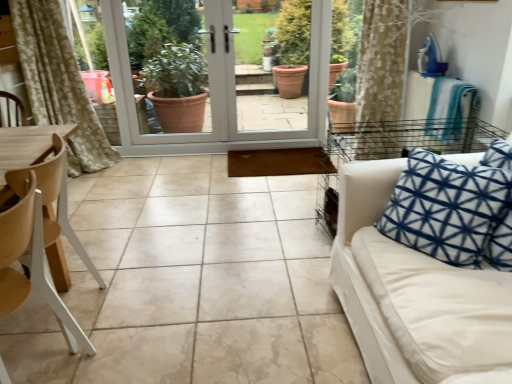
Question: Is wooden at left, the 2th chair in the front-to-back sequence, smaller than white fabric couch at right?

Choices:
 (A) no
 (B) yes

Answer: (B)

Question: From a real-world perspective, is wooden at left, the 2th chair in the front-to-back sequence, on white fabric couch at right?

Choices:
 (A) yes
 (B) no

Answer: (B)

Question: Is wooden at left, the 2th chair in the front-to-back sequence, beside white fabric couch at right?

Choices:
 (A) yes
 (B) no

Answer: (B)

Question: Is wooden at left, the 2th chair in the front-to-back sequence, thinner than white fabric couch at right?

Choices:
 (A) yes
 (B) no

Answer: (A)

Question: Can you confirm if wooden at left, the 2th chair in the front-to-back sequence, is positioned to the right of white fabric couch at right?

Choices:
 (A) yes
 (B) no

Answer: (B)

Question: Is wooden at left, the 2th chair in the front-to-back sequence, positioned before white fabric couch at right?

Choices:
 (A) yes
 (B) no

Answer: (B)

Question: Is white glossy screen door at center taller than white wood chair at left, the 2th chair from the back?

Choices:
 (A) no
 (B) yes

Answer: (B)

Question: Is white glossy screen door at center turned away from white wood chair at left, the 2th chair from the back?

Choices:
 (A) yes
 (B) no

Answer: (B)

Question: Are white glossy screen door at center and white wood chair at left, the 1th chair positioned from the front, far apart?

Choices:
 (A) yes
 (B) no

Answer: (A)

Question: From the image's perspective, is white glossy screen door at center located beneath white wood chair at left, the 2th chair from the back?

Choices:
 (A) yes
 (B) no

Answer: (B)

Question: Does white glossy screen door at center have a lesser width compared to white wood chair at left, the 2th chair from the back?

Choices:
 (A) no
 (B) yes

Answer: (B)

Question: Is white glossy screen door at center behind white wood chair at left, the 1th chair positioned from the front?

Choices:
 (A) no
 (B) yes

Answer: (B)

Question: Would you say wooden at left, placed as the 1th chair when sorted from back to front, contains white glossy screen door at center?

Choices:
 (A) no
 (B) yes

Answer: (A)